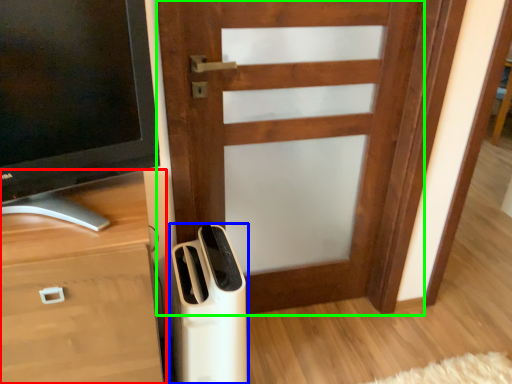
Question: Based on their relative distances, which object is farther from chest of drawers (highlighted by a red box)? Choose from home appliance (highlighted by a blue box) and door (highlighted by a green box).

Choices:
 (A) home appliance
 (B) door

Answer: (B)